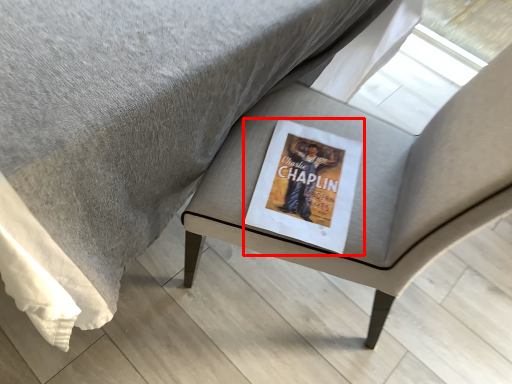
Question: From the image's perspective, considering the relative positions of paperback book (annotated by the red box) and chair in the image provided, where is paperback book (annotated by the red box) located with respect to the staircase?

Choices:
 (A) below
 (B) above

Answer: (A)